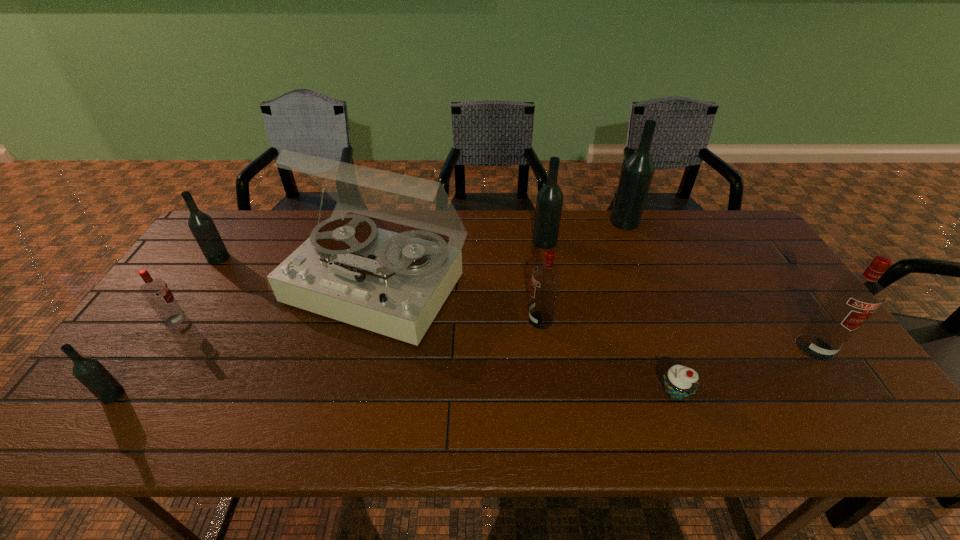
The width and height of the screenshot is (960, 540). I want to click on the sixth object from right to left, so click(x=394, y=284).

Locate an element on the screen. The image size is (960, 540). record player is located at coordinates (394, 284).

Image resolution: width=960 pixels, height=540 pixels. I want to click on the biggest black vodka, so click(x=638, y=170).

The width and height of the screenshot is (960, 540). What are the coordinates of `the farthest vodka` in the screenshot? It's located at (638, 170).

Image resolution: width=960 pixels, height=540 pixels. What are the coordinates of `the second black vodka from right to left` in the screenshot? It's located at (549, 202).

Where is `the third nearest black vodka`? This screenshot has width=960, height=540. the third nearest black vodka is located at coordinates (549, 202).

What are the coordinates of `the rightmost red vodka` in the screenshot? It's located at (853, 298).

At what (x,y) coordinates should I click in order to perform the action: click on the nearest red vodka. Please return your answer as a coordinate pair (x, y). This screenshot has height=540, width=960. Looking at the image, I should click on (853, 298).

What are the coordinates of `the second nearest black vodka` in the screenshot? It's located at (201, 225).

Where is `the second smallest black vodka`? This screenshot has height=540, width=960. the second smallest black vodka is located at coordinates (201, 225).